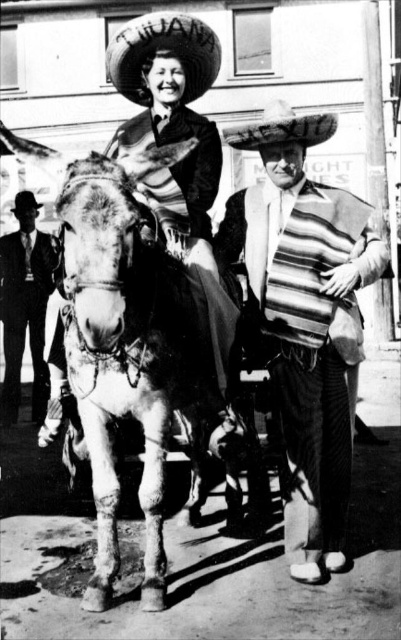
Between gray textured mule at center and white felt sombrero at center, which one has more height?

gray textured mule at center is taller.

Does point (129, 275) lie behind point (263, 129)?

No, (129, 275) is in front of (263, 129).

Find the location of a particular element. gray textured mule at center is located at coordinates (125, 348).

Does white felt sombrero at center appear on the right side of black felt cowboy hat at upper left?

Correct, you'll find white felt sombrero at center to the right of black felt cowboy hat at upper left.

Between white felt sombrero at center and black felt cowboy hat at upper left, which one is positioned lower?

white felt sombrero at center is lower down.

Which is behind, point (328, 124) or point (16, 202)?

Point (16, 202)

The image size is (401, 640). Find the location of `white felt sombrero at center`. white felt sombrero at center is located at coordinates (281, 129).

Can you confirm if smooth black suit at left is bigger than black felt cowboy hat at upper left?

Correct, smooth black suit at left is larger in size than black felt cowboy hat at upper left.

What do you see at coordinates (24, 305) in the screenshot? I see `smooth black suit at left` at bounding box center [24, 305].

You are a GUI agent. You are given a task and a screenshot of the screen. Output one action in this format:
    pyautogui.click(x=<x>, y=<y>)
    Task: Click on the smooth black suit at left
    This screenshot has height=640, width=401.
    Given the screenshot: What is the action you would take?
    pyautogui.click(x=24, y=305)